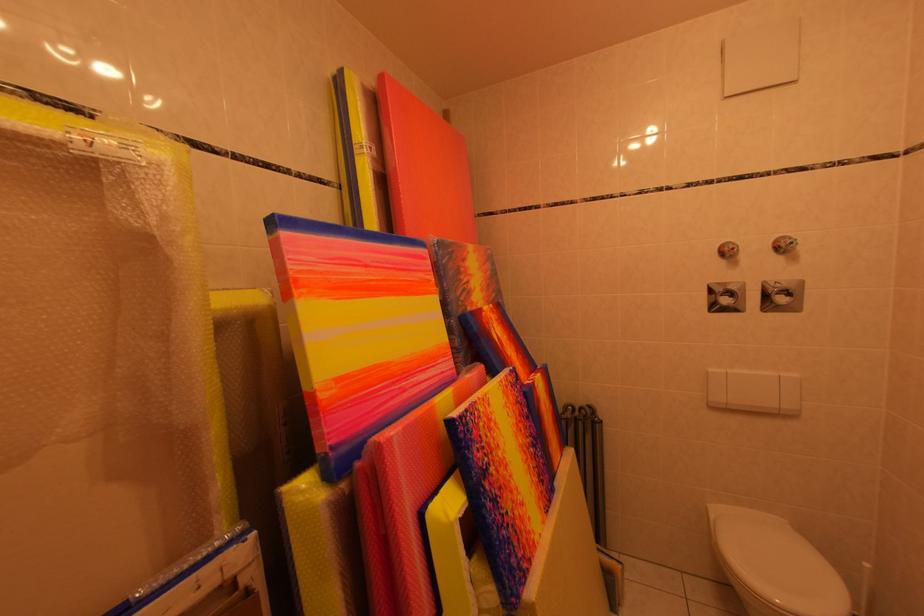
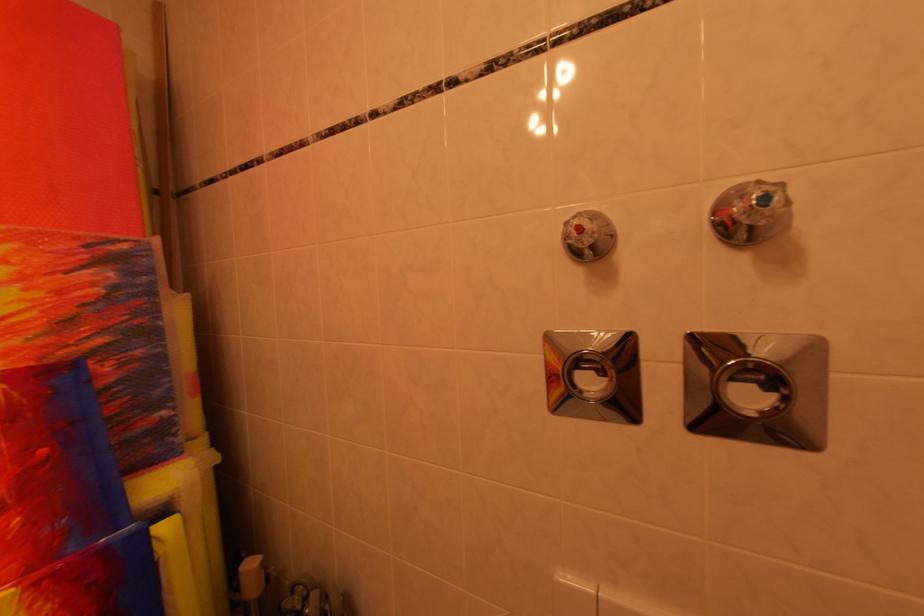
The point at (810,286) is marked in the first image. Where is the corresponding point in the second image?

(824, 351)